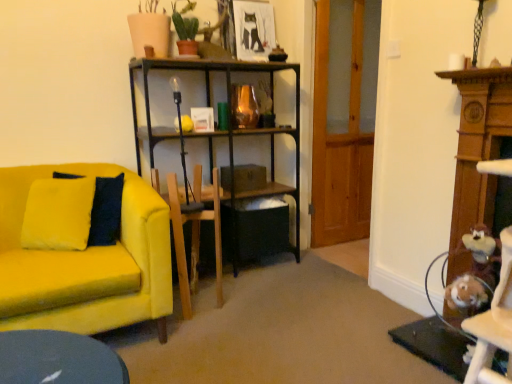
Locate an element on the screen. vacant space behind wooden swivel chair at center is located at coordinates (214, 280).